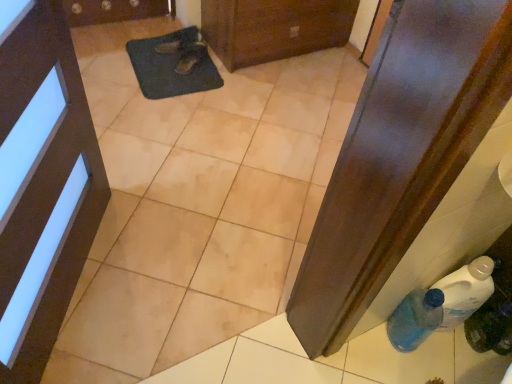
This screenshot has width=512, height=384. Find the location of `vacant region below matte black door at upper left, marked as the 1th door in a left-to-right arrangement (from a real-world perspective)`. vacant region below matte black door at upper left, marked as the 1th door in a left-to-right arrangement (from a real-world perspective) is located at coordinates (100, 294).